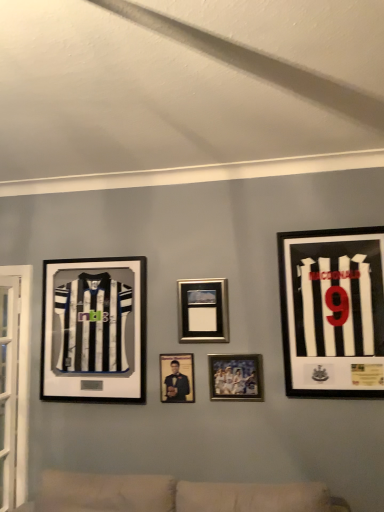
Question: Would you say black matte jersey at left, placed as the fifth picture frame when sorted from right to left, is outside matte black photo frame at center, the fourth picture frame when ordered from right to left?

Choices:
 (A) no
 (B) yes

Answer: (B)

Question: Is black matte jersey at left, placed as the fifth picture frame when sorted from right to left, closer to camera compared to matte black photo frame at center, the second picture frame viewed from the left?

Choices:
 (A) no
 (B) yes

Answer: (A)

Question: Is black matte jersey at left, the 1th picture frame positioned from the left, next to matte black photo frame at center, the fourth picture frame when ordered from right to left?

Choices:
 (A) no
 (B) yes

Answer: (A)

Question: Considering the relative sizes of black matte jersey at left, placed as the fifth picture frame when sorted from right to left, and matte black photo frame at center, the second picture frame viewed from the left, in the image provided, is black matte jersey at left, placed as the fifth picture frame when sorted from right to left, bigger than matte black photo frame at center, the second picture frame viewed from the left,?

Choices:
 (A) no
 (B) yes

Answer: (B)

Question: Could matte black photo frame at center, the fourth picture frame when ordered from right to left, be considered to be inside black matte jersey at left, the 1th picture frame positioned from the left?

Choices:
 (A) yes
 (B) no

Answer: (B)

Question: From a real-world perspective, is black matte jersey at right, the 1th picture frame from the right, above or below metallic silver photo frame at center, the 4th picture frame viewed from the left?

Choices:
 (A) above
 (B) below

Answer: (A)

Question: Is point (382, 393) closer or farther from the camera than point (248, 397)?

Choices:
 (A) farther
 (B) closer

Answer: (B)

Question: From the image's perspective, is black matte jersey at right, acting as the fifth picture frame starting from the left, located above or below metallic silver photo frame at center, the 4th picture frame viewed from the left?

Choices:
 (A) above
 (B) below

Answer: (A)

Question: Considering the positions of black matte jersey at right, the 1th picture frame from the right, and metallic silver photo frame at center, marked as the second picture frame in a right-to-left arrangement, in the image, is black matte jersey at right, the 1th picture frame from the right, wider or thinner than metallic silver photo frame at center, marked as the second picture frame in a right-to-left arrangement,?

Choices:
 (A) thin
 (B) wide

Answer: (B)

Question: From the image's perspective, is black matte jersey at right, acting as the fifth picture frame starting from the left, located above or below metallic silver photo frame at center, which appears as the 3th picture frame when viewed from the left?

Choices:
 (A) below
 (B) above

Answer: (B)

Question: Is black matte jersey at right, the 1th picture frame from the right, to the left or to the right of metallic silver photo frame at center, acting as the third picture frame starting from the right, in the image?

Choices:
 (A) left
 (B) right

Answer: (B)

Question: From a real-world perspective, is black matte jersey at right, acting as the fifth picture frame starting from the left, positioned above or below metallic silver photo frame at center, which appears as the 3th picture frame when viewed from the left?

Choices:
 (A) above
 (B) below

Answer: (B)

Question: Is black matte jersey at right, the 1th picture frame from the right, in front of or behind metallic silver photo frame at center, acting as the third picture frame starting from the right, in the image?

Choices:
 (A) front
 (B) behind

Answer: (A)

Question: From the image's perspective, is black matte jersey at left, placed as the fifth picture frame when sorted from right to left, located above or below matte black photo frame at center, the second picture frame viewed from the left?

Choices:
 (A) below
 (B) above

Answer: (B)

Question: In the image, is black matte jersey at left, the 1th picture frame positioned from the left, on the left side or the right side of matte black photo frame at center, the fourth picture frame when ordered from right to left?

Choices:
 (A) right
 (B) left

Answer: (B)